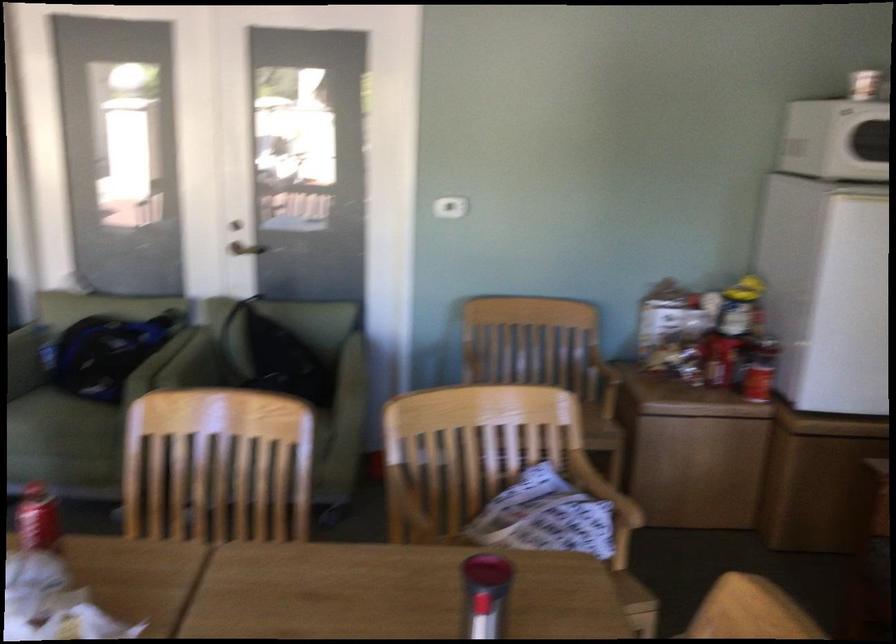
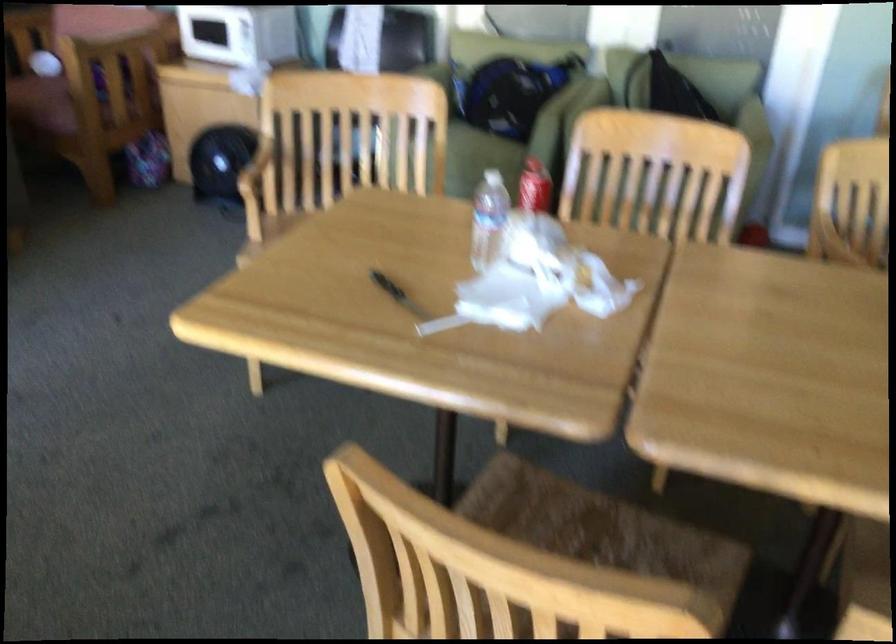
Where in the second image is the point corresponding to (x=421, y=448) from the first image?

(860, 194)